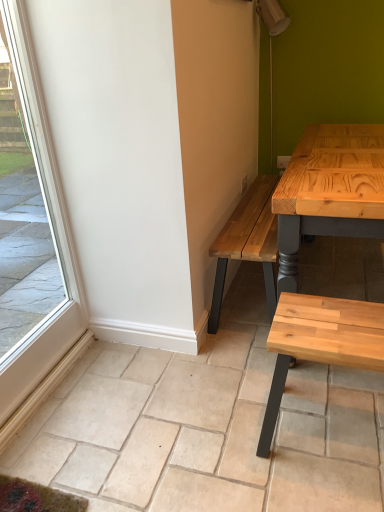
You are a GUI agent. You are given a task and a screenshot of the screen. Output one action in this format:
    pyautogui.click(x=<x>, y=<y>)
    Task: Click on the natural stone tile at lower center
    
    Given the screenshot: What is the action you would take?
    pyautogui.click(x=206, y=431)

What is the approximate width of clear glass window at left?

The width of clear glass window at left is 2.45 inches.

At what (x,y) coordinates should I click in order to perform the action: click on natural stone tile at lower center. Please return your answer as a coordinate pair (x, y). The height and width of the screenshot is (512, 384). Looking at the image, I should click on (x=206, y=431).

Are clear glass window at left and natural wood bench at lower right beside each other?

No, clear glass window at left is not next to natural wood bench at lower right.

Which is in front, point (20, 58) or point (271, 426)?

Positioned in front is point (271, 426).

From a real-world perspective, does clear glass window at left sit lower than natural wood bench at lower right?

No.

Is clear glass window at left facing away from natural wood bench at lower right?

No.

In terms of height, does natural wood bench at lower right look taller or shorter compared to natural stone tile at lower center?

Clearly, natural wood bench at lower right is taller compared to natural stone tile at lower center.

Is natural stone tile at lower center a part of natural wood bench at lower right?

No, natural stone tile at lower center is located outside of natural wood bench at lower right.

Which object is thinner, natural wood bench at lower right or natural stone tile at lower center?

natural wood bench at lower right is thinner.

Is natural wood bench at lower right with natural stone tile at lower center?

No, natural wood bench at lower right is not making contact with natural stone tile at lower center.

Is point (382, 410) more distant than point (51, 346)?

No.

Considering the positions of objects natural stone tile at lower center and clear glass window at left in the image provided, who is behind, natural stone tile at lower center or clear glass window at left?

natural stone tile at lower center.

Is natural stone tile at lower center touching clear glass window at left?

No, natural stone tile at lower center is not making contact with clear glass window at left.

Between natural stone tile at lower center and clear glass window at left, which one has smaller width?

clear glass window at left.

From the image's perspective, is natural stone tile at lower center positioned above or below natural wood bench at lower right?

Clearly, from the image's perspective, natural stone tile at lower center is above natural wood bench at lower right.

From the picture: From a real-world perspective, which object stands above the other?

From a 3D spatial view, natural wood bench at lower right is above.

Is natural stone tile at lower center positioned with its back to natural wood bench at lower right?

No, natural wood bench at lower right is not at the back of natural stone tile at lower center.

Which object is further away from the camera taking this photo, natural stone tile at lower center or natural wood bench at lower right?

natural wood bench at lower right is behind.

Does clear glass window at left turn towards natural stone tile at lower center?

No, clear glass window at left does not turn towards natural stone tile at lower center.

In the scene shown: Is clear glass window at left far away from natural stone tile at lower center?

No, clear glass window at left is not far from natural stone tile at lower center.

Based on the photo, how different are the orientations of clear glass window at left and natural stone tile at lower center in degrees?

0.0753 degrees.

Consider the image. From a real-world perspective, is clear glass window at left physically above natural stone tile at lower center?

Correct, in the physical world, clear glass window at left is higher than natural stone tile at lower center.

How distant is natural wood bench at lower right from clear glass window at left?

natural wood bench at lower right and clear glass window at left are 1.08 meters apart from each other.

Is natural wood bench at lower right inside or outside of clear glass window at left?

The correct answer is: outside.

From a real-world perspective, does natural wood bench at lower right stand above clear glass window at left?

No, from a real-world perspective, natural wood bench at lower right is not on top of clear glass window at left.

This screenshot has height=512, width=384. In the image, there is a clear glass window at left. In order to click on coffee table below it (from a real-world perspective) in this screenshot , I will do `click(320, 342)`.

Image resolution: width=384 pixels, height=512 pixels. What are the coordinates of `window that is on the left side of natural wood bench at lower right` in the screenshot? It's located at (59, 249).

This screenshot has height=512, width=384. Find the location of `tile in front of the natural wood bench at lower right`. tile in front of the natural wood bench at lower right is located at coordinates (206, 431).

Estimate the real-world distances between objects in this image. Which object is further from natural wood bench at lower right, natural stone tile at lower center or clear glass window at left?

clear glass window at left lies further to natural wood bench at lower right than the other object.

Which object lies nearer to the anchor point natural stone tile at lower center, natural wood bench at lower right or clear glass window at left?

natural wood bench at lower right.

Based on their spatial positions, is natural wood bench at lower right or natural stone tile at lower center further from clear glass window at left?

natural wood bench at lower right is further to clear glass window at left.

From the image, which object appears to be farther from natural stone tile at lower center, clear glass window at left or natural wood bench at lower right?

Among the two, clear glass window at left is located further to natural stone tile at lower center.

Which object lies nearer to the anchor point clear glass window at left, natural stone tile at lower center or natural wood bench at lower right?

natural stone tile at lower center lies closer to clear glass window at left than the other object.

Estimate the real-world distances between objects in this image. Which object is further from natural wood bench at lower right, clear glass window at left or natural stone tile at lower center?

Based on the image, clear glass window at left appears to be further to natural wood bench at lower right.

Find the location of `tile between clear glass window at left and natural wood bench at lower right from left to right`. tile between clear glass window at left and natural wood bench at lower right from left to right is located at coordinates (206, 431).